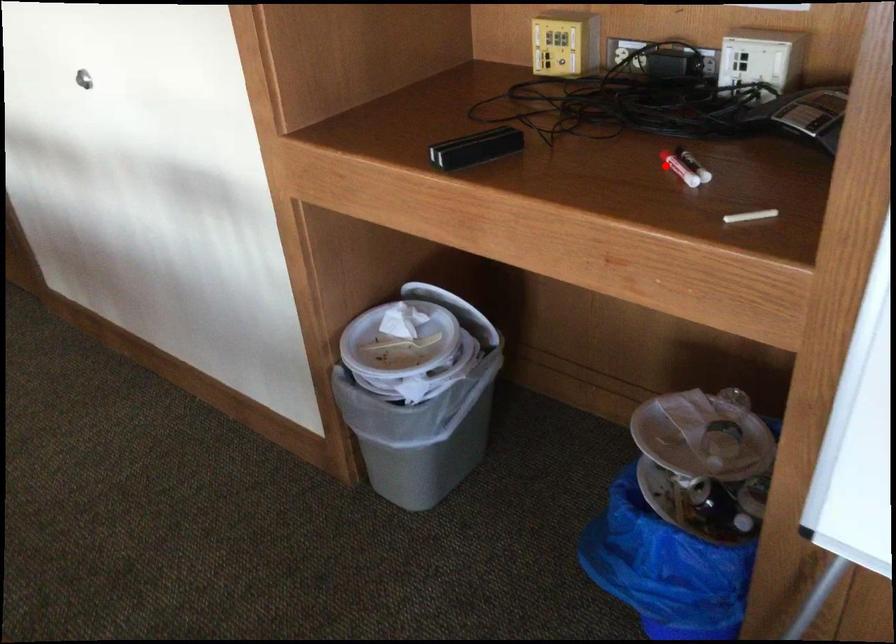
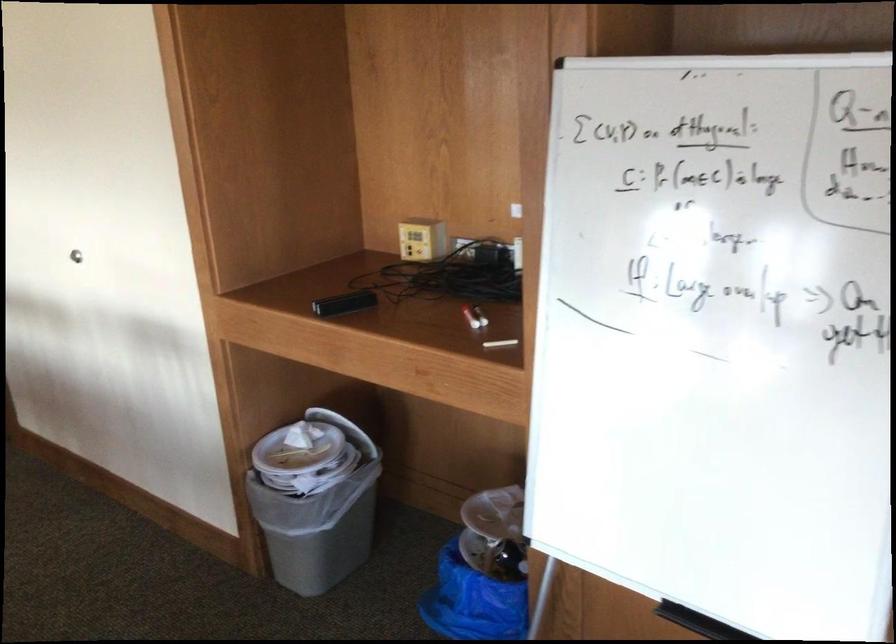
Question: I am providing you with two images of the same scene from different viewpoints. Given a red point in image1, look at the same physical point in image2. Is it:

Choices:
 (A) Closer to the viewpoint
 (B) Farther from the viewpoint

Answer: (B)